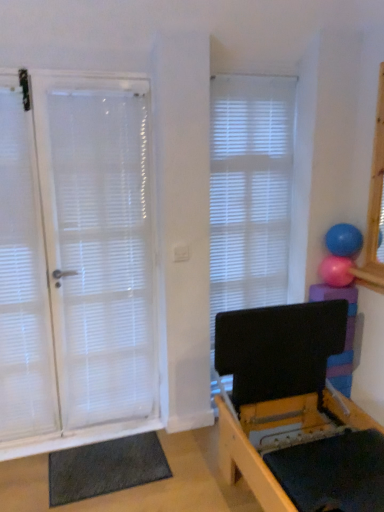
Question: From the image's perspective, is white sheer curtain at left located above or below pink rubber ball at upper right, which is the 2th ball in top-to-bottom order?

Choices:
 (A) above
 (B) below

Answer: (B)

Question: Is white sheer curtain at left in front of or behind pink rubber ball at upper right, the 1th ball positioned from the bottom, in the image?

Choices:
 (A) front
 (B) behind

Answer: (A)

Question: Estimate the real-world distances between objects in this image. Which object is farther from the white sheer curtain at left?

Choices:
 (A) white matte door at left
 (B) white matte window blind at center
 (C) pink rubber ball at upper right, the 1th ball positioned from the bottom
 (D) blue rubber ball at upper right, positioned as the 2th ball in bottom-to-top order
 (E) dark gray textured yoga mat at lower left

Answer: (D)

Question: Which of these objects is positioned farthest from the white matte door at left?

Choices:
 (A) blue rubber ball at upper right, acting as the 1th ball starting from the top
 (B) pink rubber ball at upper right, the 1th ball positioned from the bottom
 (C) white sheer curtain at left
 (D) white matte window blind at center
 (E) dark gray textured yoga mat at lower left

Answer: (A)